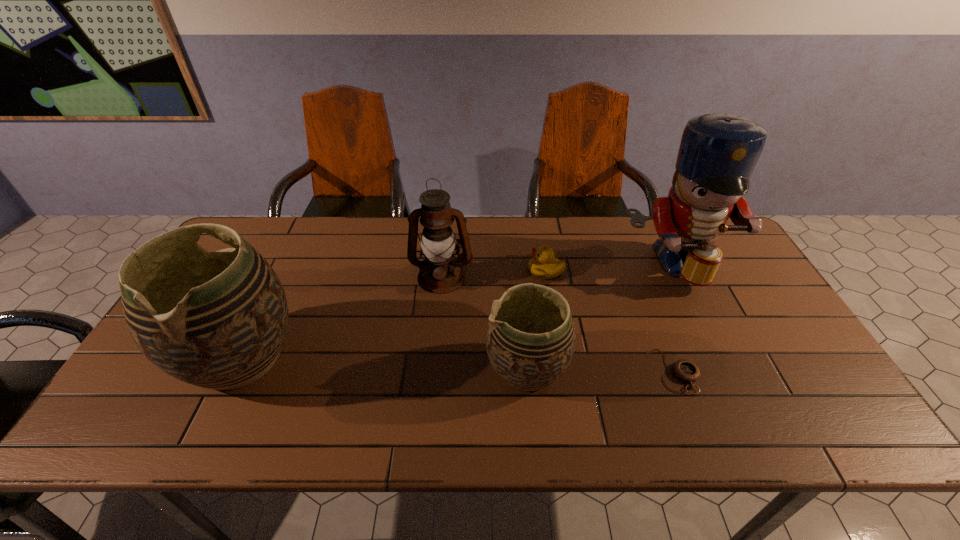
You are a GUI agent. You are given a task and a screenshot of the screen. Output one action in this format:
    pyautogui.click(x=<x>, y=<y>)
    Task: Click on the vacant area that satisfies the following two spatial constraints: 1. on the side of the lantern, there is a wick adjustment knob; 2. on the right side of the shortest object
    The width and height of the screenshot is (960, 540).
    Given the screenshot: What is the action you would take?
    pyautogui.click(x=433, y=371)